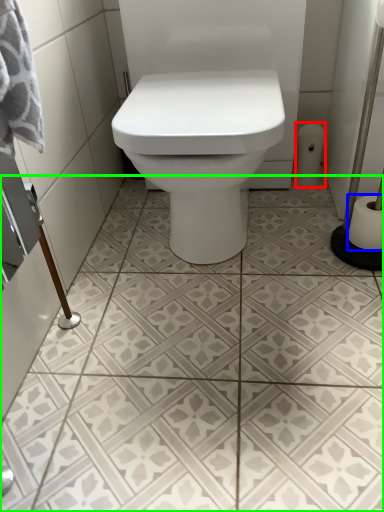
Question: Which object is the farthest from toilet paper (highlighted by a red box)? Choose among these: toilet paper (highlighted by a blue box) or ceramic tile (highlighted by a green box).

Choices:
 (A) toilet paper
 (B) ceramic tile

Answer: (B)